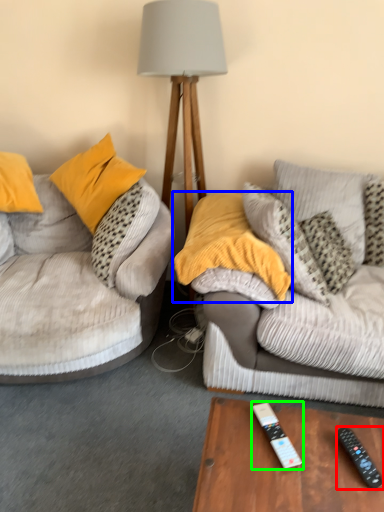
Question: Based on their relative distances, which object is farther from remote control (highlighted by a red box)? Choose from pillow (highlighted by a blue box) and remote control (highlighted by a green box).

Choices:
 (A) pillow
 (B) remote control

Answer: (A)